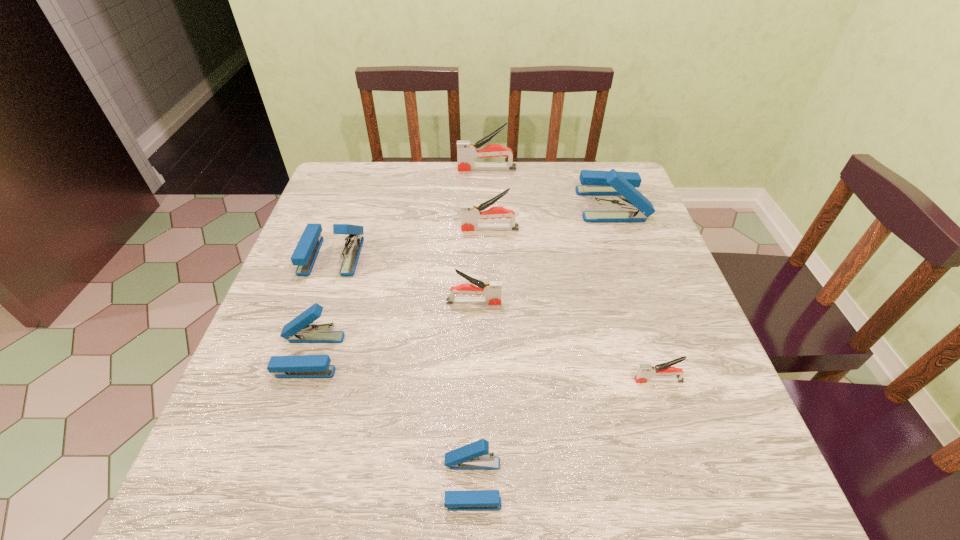
Locate which stapler ranks in proximity to the farthest gray stapler. Please provide its 2D coordinates. Your answer should be formatted as a tuple, i.e. [(x, y)], where the tuple contains the x and y coordinates of a point satisfying the conditions above.

[(594, 183)]

The width and height of the screenshot is (960, 540). I want to click on stapler that is the seventh closest to the biggest gray stapler, so 475,456.

Locate an element on the screen. The width and height of the screenshot is (960, 540). gray stapler that is the second closest one to the second farthest gray stapler is located at coordinates (466, 152).

Locate an element on the screen. Image resolution: width=960 pixels, height=540 pixels. gray stapler that is the second closest to the nearest stapler is located at coordinates (492, 290).

Point out which blue stapler is positioned as the fourth nearest to the third biggest gray stapler. Please provide its 2D coordinates. Your answer should be formatted as a tuple, i.e. [(x, y)], where the tuple contains the x and y coordinates of a point satisfying the conditions above.

[(594, 183)]

Identify the location of blue stapler that is the fourth closest one to the farthest object. (475, 456).

You are a GUI agent. You are given a task and a screenshot of the screen. Output one action in this format:
    pyautogui.click(x=<x>, y=<y>)
    Task: Click on the vacant region that satisfies the following two spatial constraints: 1. on the handle side of the farthest blue stapler; 2. on the left side of the farthest object
    This screenshot has height=540, width=960.
    Given the screenshot: What is the action you would take?
    pyautogui.click(x=488, y=205)

At what (x,y) coordinates should I click in order to perform the action: click on free space that satisfies the following two spatial constraints: 1. on the handle side of the fifth farthest stapler; 2. on the front side of the second smallest blue stapler. Please return your answer as a coordinate pair (x, y). Looking at the image, I should click on (473, 355).